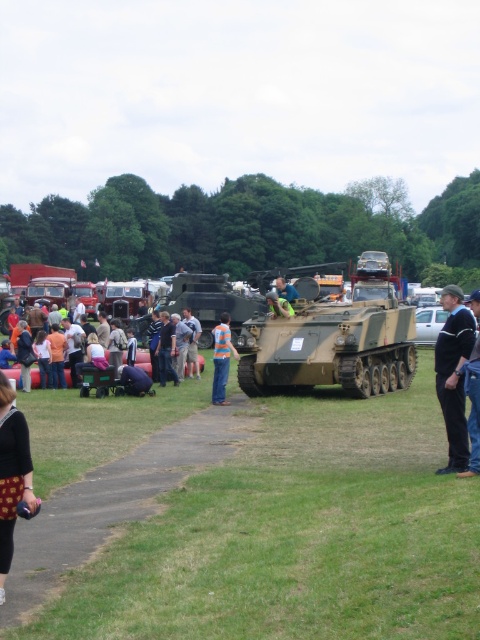
In the scene shown: You are a photographer at the event. You want to capture a photo that includes both the matte green tank at center and the orange shirt at center. Which object should you zoom in on to ensure both are in frame?

You should zoom in on the orange shirt at center because the matte green tank at center is bigger than the orange shirt at center, so zooming in on the smaller object will help fit both into the frame.

Consider the image. You are a photographer standing at the edge of the grassy area. You want to take a photo of the matte green tank at center and the orange shirt at center in the same frame. Can you fit both subjects into your camera viewfinder without moving your position? Explain your reasoning.

The matte green tank at center and orange shirt at center are 16.59 feet apart. Since the distance between them is 16.59 feet, and assuming a typical camera viewfinder can capture such a span from your current position, it should be possible to include both in the frame without moving.

You are a photographer trying to capture both the black fabric jacket at center and the matte green tank at center in a single shot. Based on their positions, which object should you focus on first to ensure both are in frame?

Result: The black fabric jacket at center is positioned on the right side of matte green tank at center, so you should focus on the matte green tank at center first to ensure both are in frame.